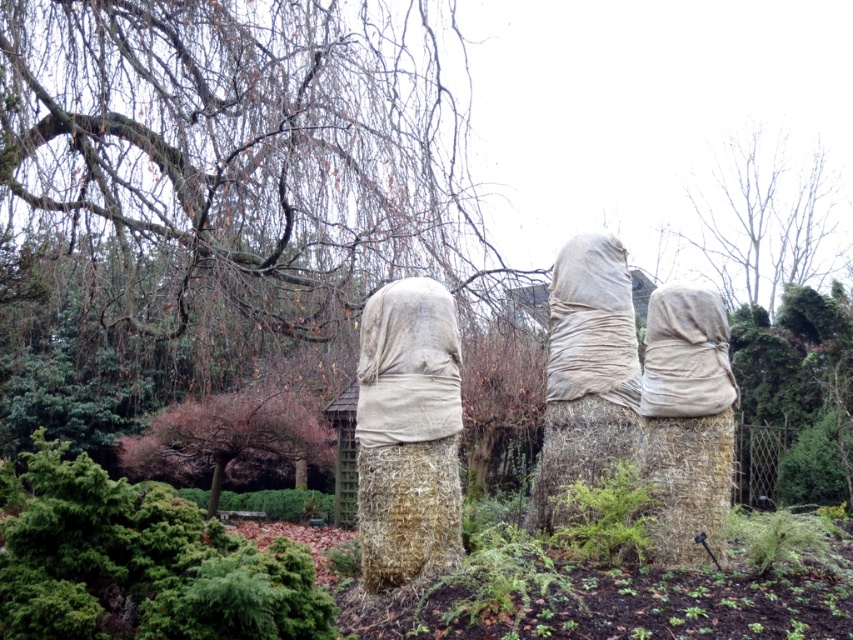
You are a landscape architect designing a walking path between the brown mossy tree trunk at upper left and the matte beige fabric at right. What is the minimum length the path should be to ensure it connects both points without detouring around obstacles?

The minimum length of the path should be at least 13.81 feet to directly connect the brown mossy tree trunk at upper left and the matte beige fabric at right without detouring around obstacles.

You are a bird flying over the garden scene. You want to land on the brown mossy tree trunk at upper left but need to avoid the bare branches at upper center. Can you safely land there without hitting the branches?

The brown mossy tree trunk at upper left is in front of the bare branches at upper center, so landing there would not cause any collision with the branches.